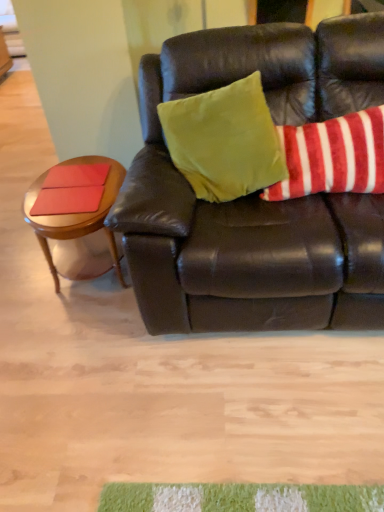
Question: Is woodenwoodentable at left at the right side of matte brown leather couch at center?

Choices:
 (A) no
 (B) yes

Answer: (A)

Question: Can you confirm if woodenwoodentable at left is taller than matte brown leather couch at center?

Choices:
 (A) yes
 (B) no

Answer: (B)

Question: From a real-world perspective, is woodenwoodentable at left located beneath matte brown leather couch at center?

Choices:
 (A) yes
 (B) no

Answer: (A)

Question: From the image's perspective, would you say woodenwoodentable at left is positioned over matte brown leather couch at center?

Choices:
 (A) no
 (B) yes

Answer: (A)

Question: Is woodenwoodentable at left positioned behind matte brown leather couch at center?

Choices:
 (A) yes
 (B) no

Answer: (A)

Question: Considering their positions, is matte brown leather couch at center located in front of or behind red/white striped pillow at upper right, the 1th pillow when ordered from right to left?

Choices:
 (A) front
 (B) behind

Answer: (A)

Question: From the image's perspective, is matte brown leather couch at center positioned above or below red/white striped pillow at upper right, the 1th pillow when ordered from right to left?

Choices:
 (A) above
 (B) below

Answer: (B)

Question: Is matte brown leather couch at center wider or thinner than red/white striped pillow at upper right, the 1th pillow when ordered from right to left?

Choices:
 (A) wide
 (B) thin

Answer: (A)

Question: Is matte brown leather couch at center spatially inside red/white striped pillow at upper right, the 1th pillow when ordered from right to left, or outside of it?

Choices:
 (A) inside
 (B) outside

Answer: (B)

Question: Looking at the image, does matte red pad at left, the second pad from the bottom, seem bigger or smaller compared to matte brown leather couch at center?

Choices:
 (A) big
 (B) small

Answer: (B)

Question: Considering their positions, is matte red pad at left, which ranks as the second pad in front-to-back order, located in front of or behind matte brown leather couch at center?

Choices:
 (A) front
 (B) behind

Answer: (B)

Question: Does point (49, 170) appear closer or farther from the camera than point (162, 273)?

Choices:
 (A) closer
 (B) farther

Answer: (B)

Question: From the image's perspective, relative to matte brown leather couch at center, is matte red pad at left, the second pad from the bottom, above or below?

Choices:
 (A) below
 (B) above

Answer: (B)

Question: In terms of size, does woodenwoodentable at left appear bigger or smaller than velvety green pillow at upper center, which is the first pillow in left-to-right order?

Choices:
 (A) small
 (B) big

Answer: (A)

Question: Visually, is woodenwoodentable at left positioned to the left or to the right of velvety green pillow at upper center, arranged as the second pillow when viewed from the right?

Choices:
 (A) right
 (B) left

Answer: (B)